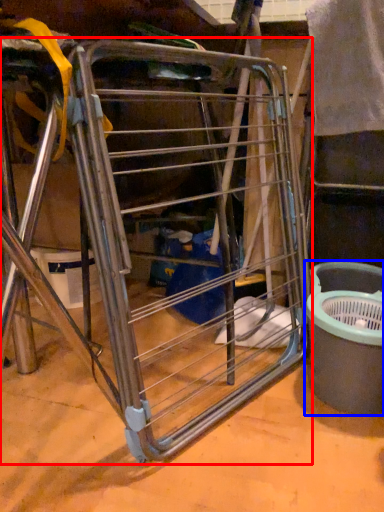
Question: Which object appears closest to the camera in this image, furniture (highlighted by a red box) or recycling bin (highlighted by a blue box)?

Choices:
 (A) furniture
 (B) recycling bin

Answer: (A)